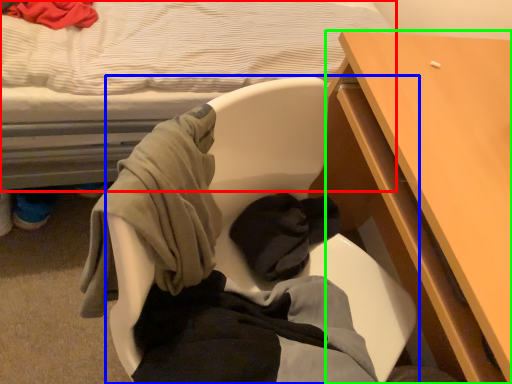
Question: Based on their relative distances, which object is nearer to bed (highlighted by a red box)? Choose from chair (highlighted by a blue box) and desk (highlighted by a green box).

Choices:
 (A) chair
 (B) desk

Answer: (A)